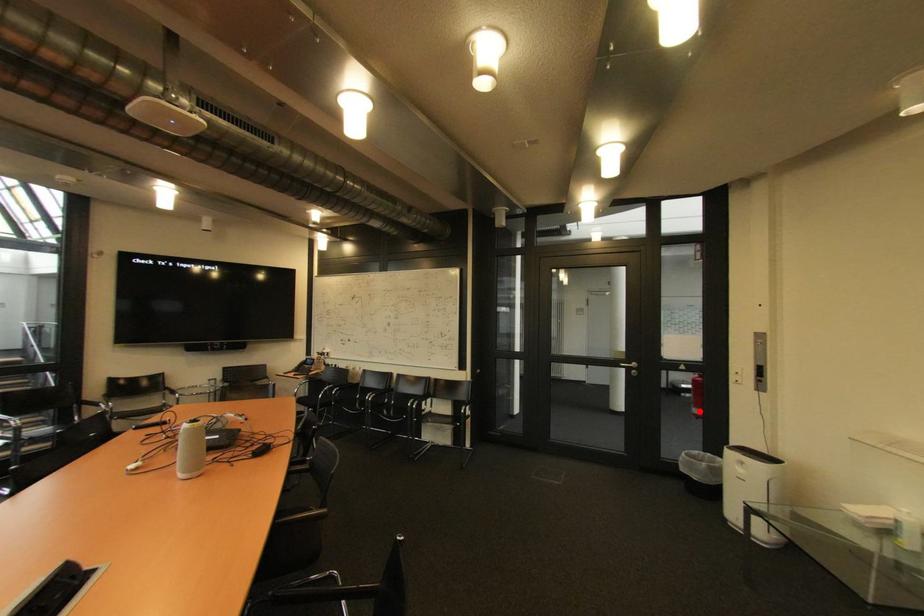
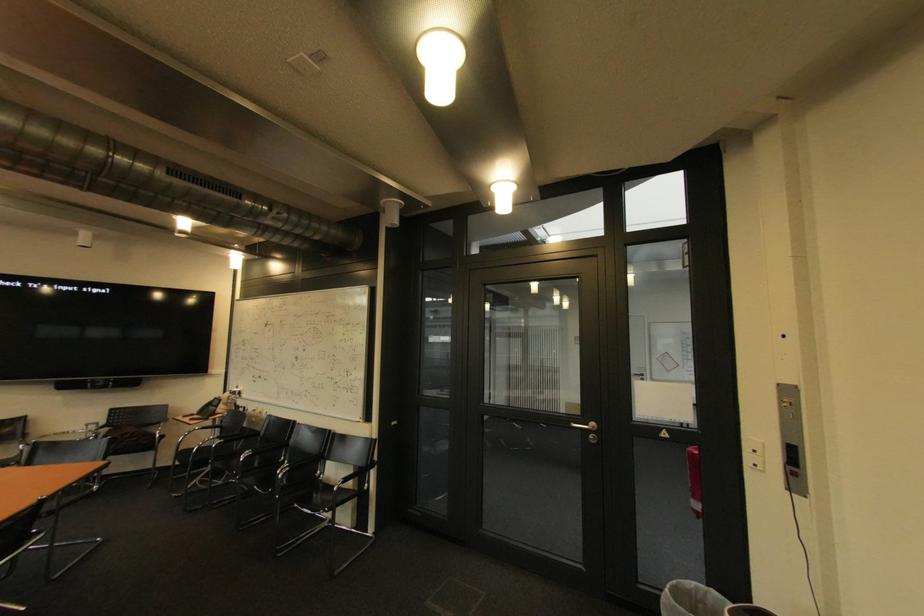
Question: I am providing you with two images of the same scene from different viewpoints. Given a red point in image1, look at the same physical point in image2. Is it:

Choices:
 (A) Closer to the viewpoint
 (B) Farther from the viewpoint

Answer: (B)